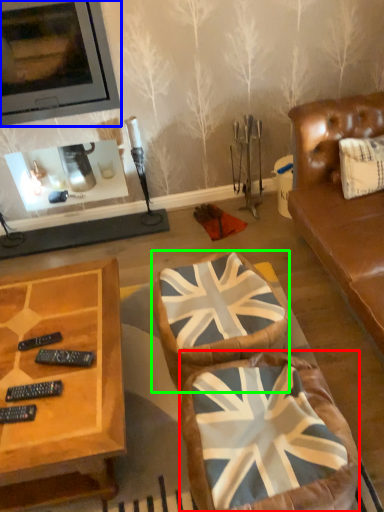
Question: Which object is positioned closest to swivel chair (highlighted by a red box)? Select from picture frame (highlighted by a blue box) and swivel chair (highlighted by a green box).

Choices:
 (A) picture frame
 (B) swivel chair

Answer: (B)